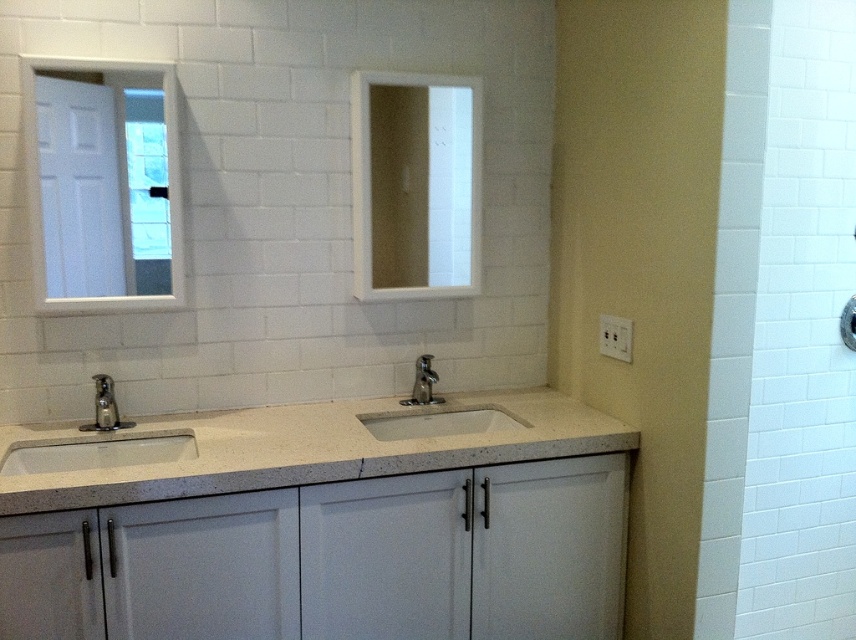
You are designing a bathroom renovation and need to choose between the matte silver faucet at left and the polished chrome faucet at center. Based on their sizes, which faucet would be better suited for a space where width is a concern?

The matte silver faucet at left is thinner than the polished chrome faucet at center, so it would be better suited for a space where width is a concern.

You are standing in front of the bathroom vanity and need to place a decorative item on the countertop. Where should you place it to ensure it is centered between the white matte sink at lower left and the other sink? Please provide coordinates based on the image grid system provided in the description.

The white matte sink at lower left is located at point (97, 451). To center the decorative item between the two sinks, you would need to calculate the midpoint between their coordinates. However, since the coordinates of the second sink are not provided, an exact placement cannot be determined with the given information.

What are the coordinates of the matte silver faucet at left?

The coordinates of the matte silver faucet at left are at point [105,403].